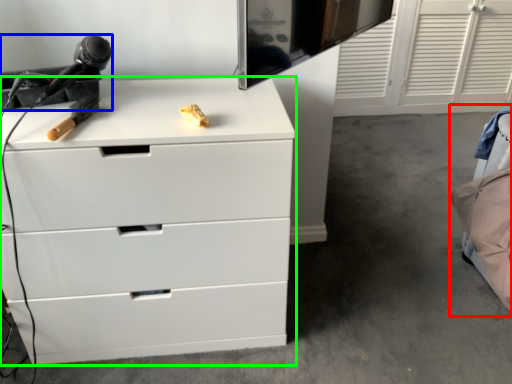
Question: Which object is positioned closest to bed (highlighted by a red box)? Select from equipment (highlighted by a blue box) and chest of drawers (highlighted by a green box).

Choices:
 (A) equipment
 (B) chest of drawers

Answer: (B)